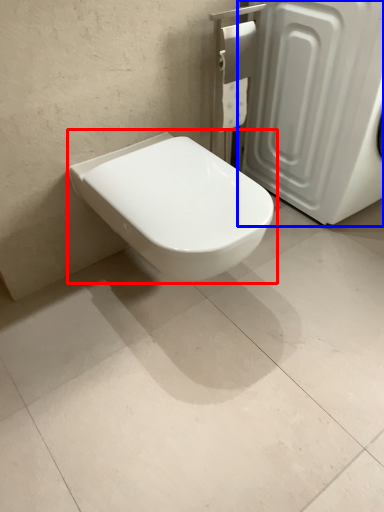
Question: Which point is further to the camera, toilet (highlighted by a red box) or screen door (highlighted by a blue box)?

Choices:
 (A) toilet
 (B) screen door

Answer: (B)